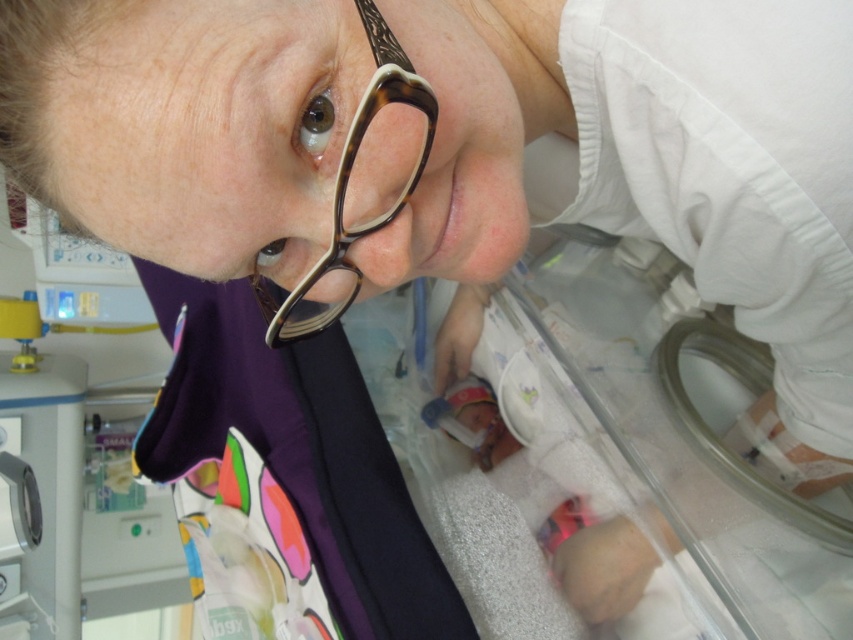
You are a medical student observing the scene in the NICU. You notice the tortoiseshell frame glasses at upper center and the soft white blanket at center. Which object appears bigger in the image?

The tortoiseshell frame glasses at upper center is larger in size than the soft white blanket at center, so the tortoiseshell frame glasses at upper center appears bigger.

Consider the image. You are a medical professional in the NICU and need to access the incubator. The camera is positioned where you are standing. Is the point at coordinates point (376, 173) within reach without moving your position? Please consider the distance provided.

The distance between point (376, 173) and the camera is 14.36 inches. Since the average human arm length is about 25 to 30 inches, you can easily reach the point at point (376, 173) without moving your position.

You are a nurse in the NICU and need to reach both points. Which point, point [408,106] or point [602,548], is closer to you?

Point [408,106] is closer to the viewer than point [602,548].